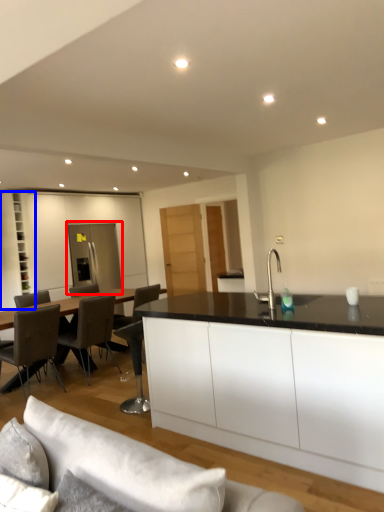
Question: Which object is further to the camera taking this photo, glass door (highlighted by a red box) or cabinetry (highlighted by a blue box)?

Choices:
 (A) glass door
 (B) cabinetry

Answer: (A)